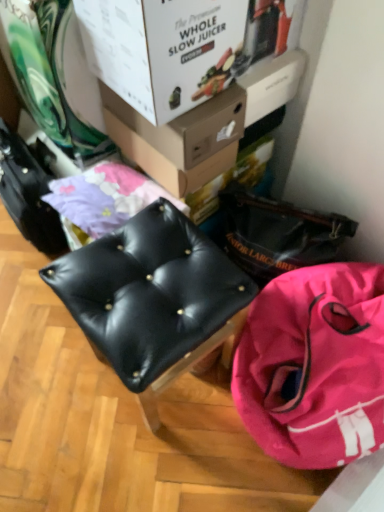
Question: From a real-world perspective, is matte cardboard box at upper center, marked as the 1th box in a back-to-front arrangement, above or below white cardboard box at upper center, placed as the 1th box when sorted from front to back?

Choices:
 (A) above
 (B) below

Answer: (B)

Question: Relative to white cardboard box at upper center, which is the second box from back to front, is matte cardboard box at upper center, marked as the 1th box in a back-to-front arrangement, in front or behind?

Choices:
 (A) front
 (B) behind

Answer: (B)

Question: Which of these objects is positioned farthest from the black leather stool at center?

Choices:
 (A) matte cardboard box at upper center, acting as the second box starting from the front
 (B) white cardboard box at upper center, which is the second box from back to front
 (C) pink fabric bag at lower right

Answer: (B)

Question: Based on their relative distances, which object is nearer to the black leather stool at center?

Choices:
 (A) pink fabric bag at lower right
 (B) matte cardboard box at upper center, marked as the 1th box in a back-to-front arrangement
 (C) white cardboard box at upper center, which is the second box from back to front

Answer: (A)